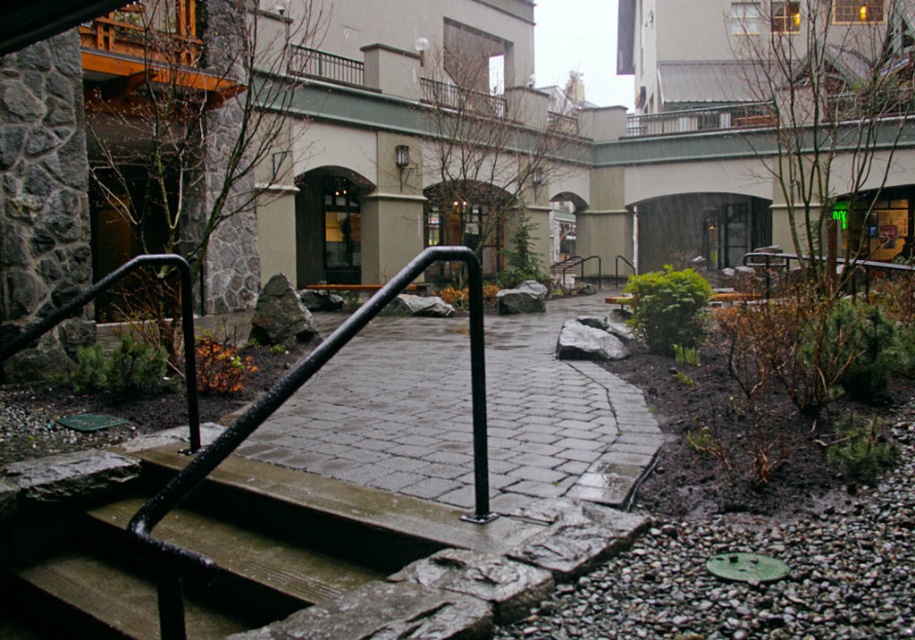
You are standing at the bottom of the wooden stairs at center and want to reach the black metal railing at center. Which direction should you move to get there?

The black metal railing at center is to the right of the wooden stairs at center, so you should move to your right to reach it.

You are a delivery person carrying a large box that is 36 inches wide. You need to walk through the space between the black metal railing at center and the wooden stairs at center. Can you pass through this space without tilting the box sideways?

The space between the black metal railing at center and the wooden stairs at center is only 33.73 inches wide. Since your box is 36 inches wide, which is wider than the available space, you cannot pass through without tilting the box sideways.